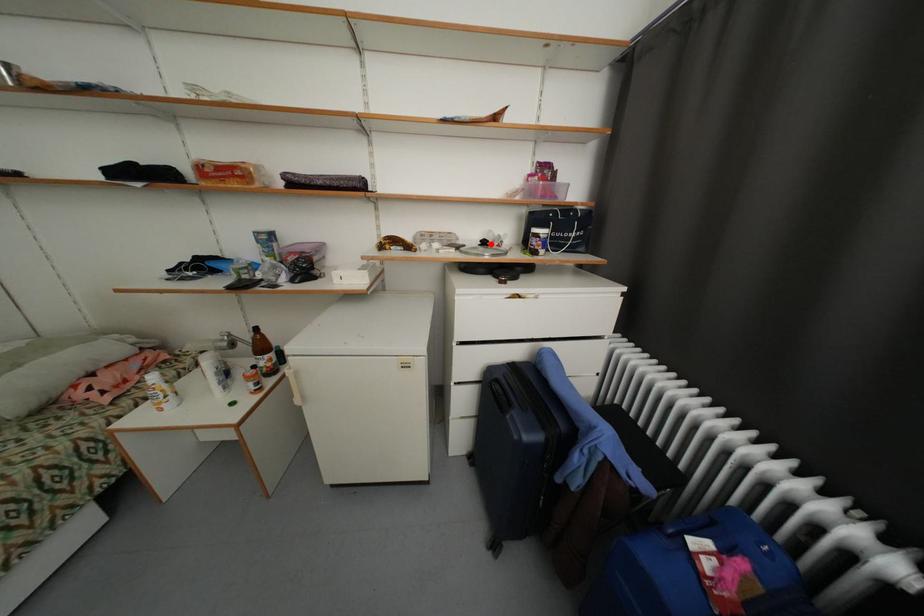
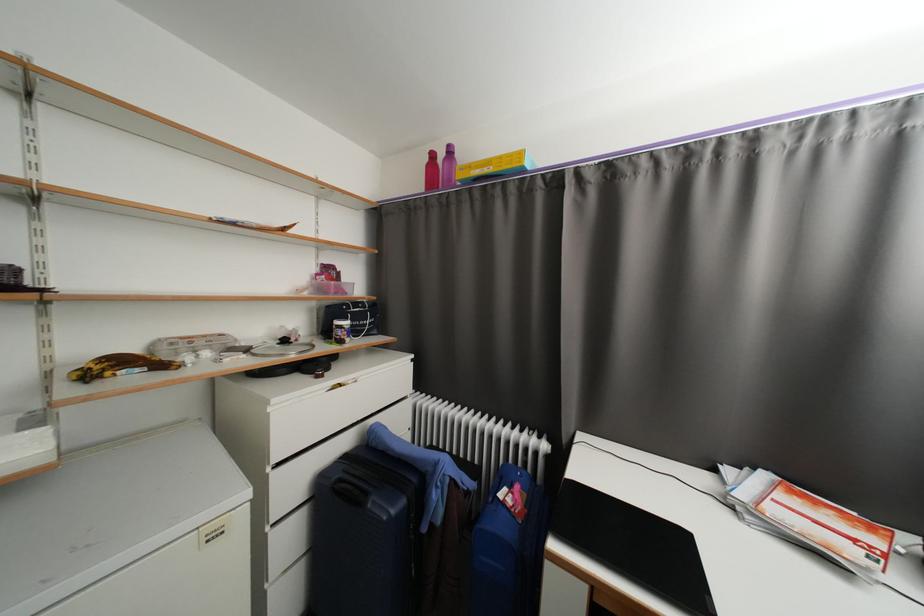
The point at the highlighted location is marked in the first image. Where is the corresponding point in the second image?

(290, 342)